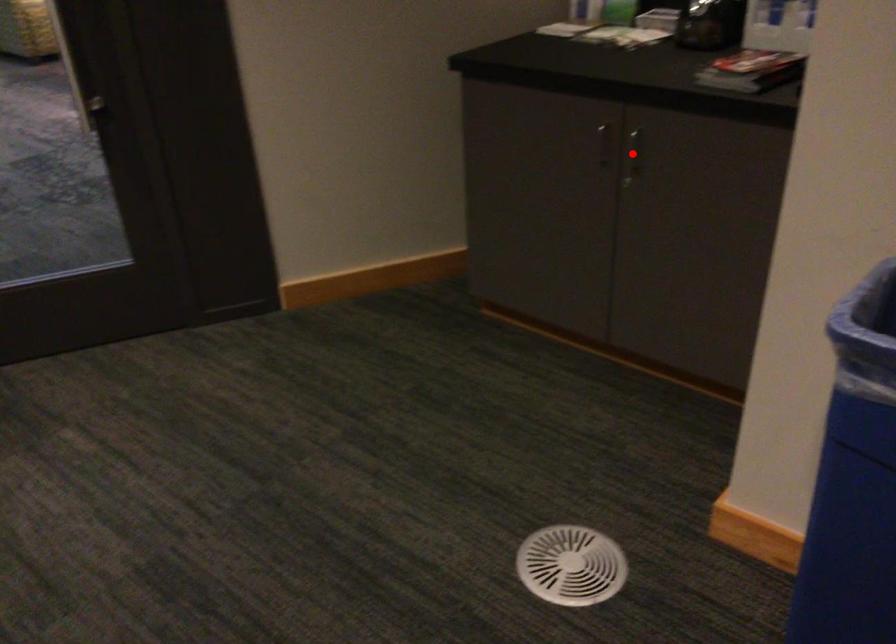
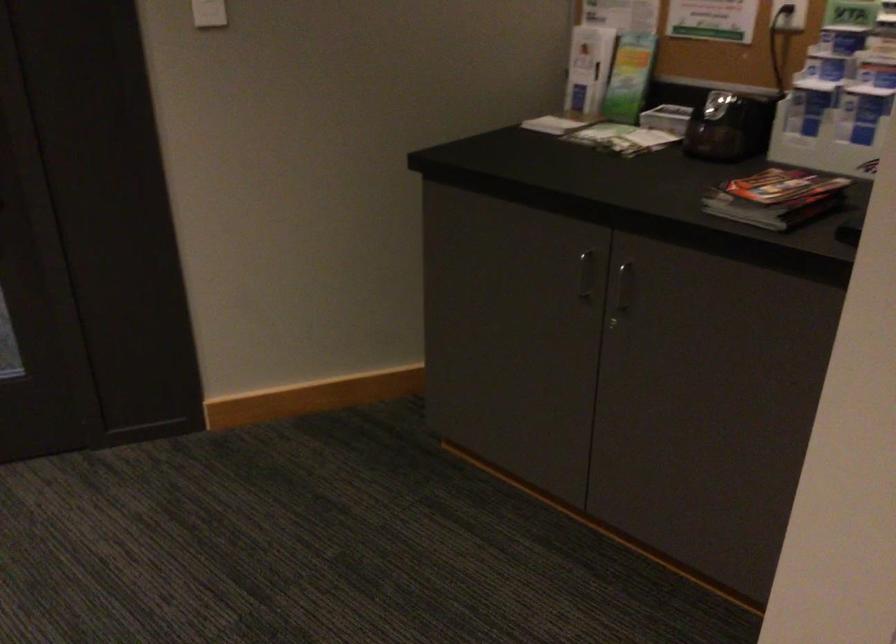
Question: I am providing you with two images of the same scene from different viewpoints. A red point is shown in image1. For the corresponding object point in image2, is it positioned nearer or farther from the camera?

Choices:
 (A) Nearer
 (B) Farther

Answer: (A)